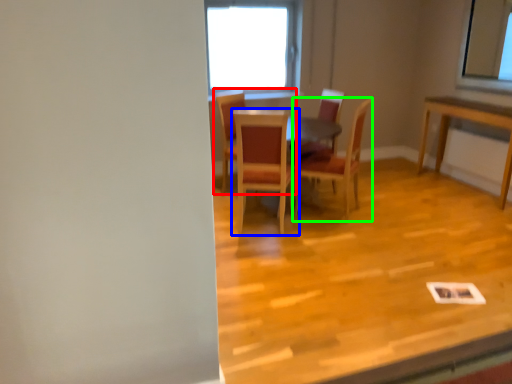
Question: Which object is the closest to the chair (highlighted by a red box)? Choose among these: chair (highlighted by a blue box) or chair (highlighted by a green box).

Choices:
 (A) chair
 (B) chair

Answer: (A)